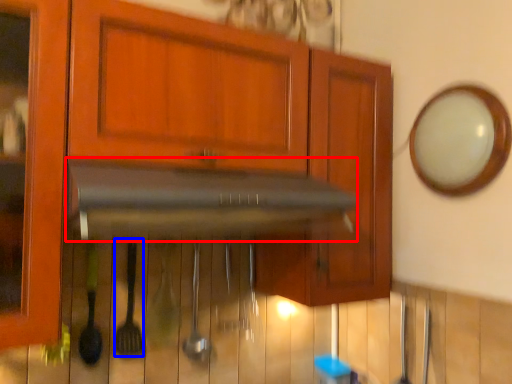
Question: Among these objects, which one is nearest to the camera, vent (highlighted by a red box) or silverware (highlighted by a blue box)?

Choices:
 (A) vent
 (B) silverware

Answer: (A)